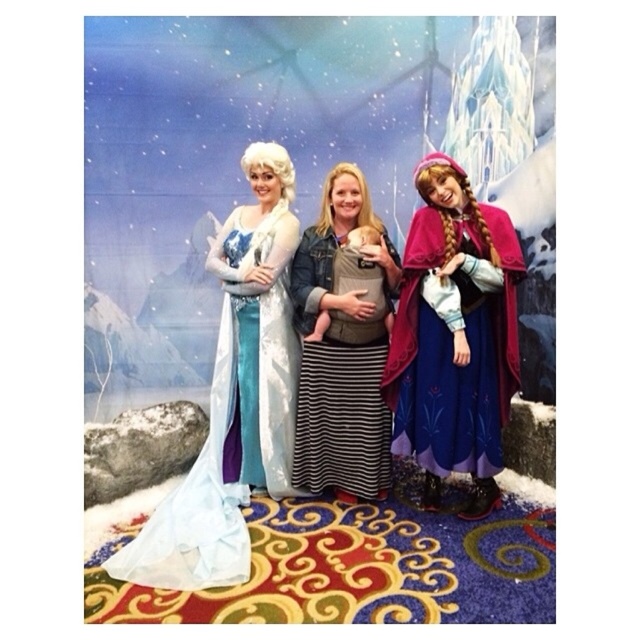
You are a costume designer preparing for a Frozen themed party. You have two items to display next to each other on a mannequin stand. The velvet purple cape at right and the striped denim jacket at center. Which item requires more horizontal space to display properly?

The velvet purple cape at right requires more horizontal space to display properly because its width is larger than the striped denim jacket at center.